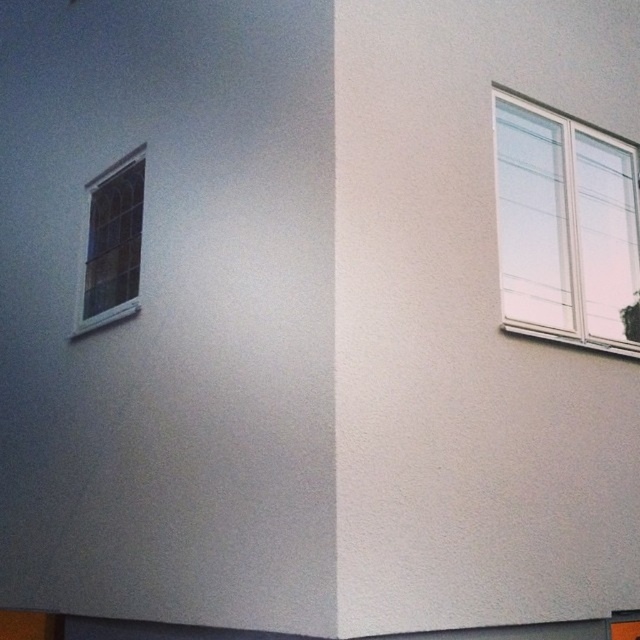
Question: Does clear glass window at upper right appear on the left side of clear glass window at upper left?

Choices:
 (A) yes
 (B) no

Answer: (B)

Question: Which object is closer to the camera taking this photo?

Choices:
 (A) clear glass window at upper left
 (B) clear glass window at upper right

Answer: (B)

Question: Among these points, which one is nearest to the camera?

Choices:
 (A) (508, 285)
 (B) (120, 307)

Answer: (A)

Question: Where is clear glass window at upper right located in relation to clear glass window at upper left in the image?

Choices:
 (A) left
 (B) right

Answer: (B)

Question: Which point appears farthest from the camera in this image?

Choices:
 (A) (500, 141)
 (B) (88, 237)

Answer: (B)

Question: Is clear glass window at upper right above clear glass window at upper left?

Choices:
 (A) yes
 (B) no

Answer: (A)